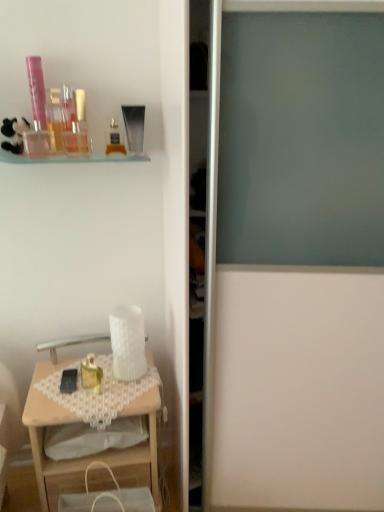
Image resolution: width=384 pixels, height=512 pixels. I want to click on free space above wooden desk at lower left (from a real-world perspective), so click(x=95, y=383).